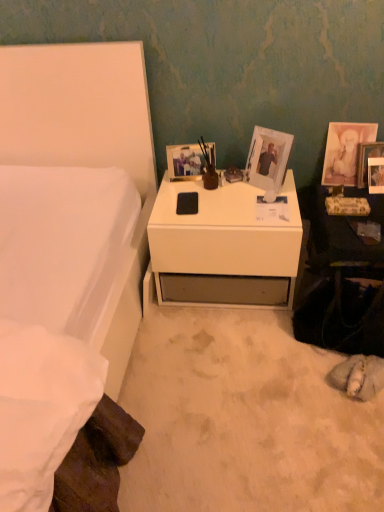
Where is `free space in front of white matte desk at center`? This screenshot has width=384, height=512. free space in front of white matte desk at center is located at coordinates (224, 369).